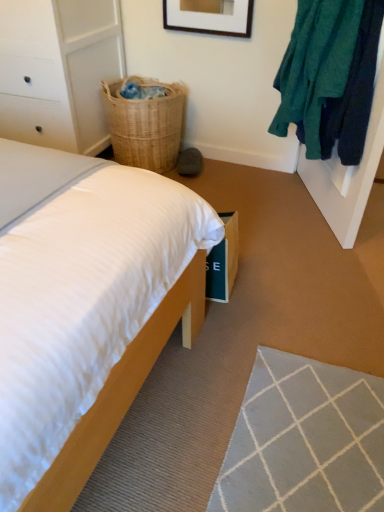
Question: Is white painted wood dresser at left taller than woven natural basket at upper right?

Choices:
 (A) yes
 (B) no

Answer: (A)

Question: Is woven natural basket at upper right completely or partially inside white painted wood dresser at left?

Choices:
 (A) yes
 (B) no

Answer: (B)

Question: From the image's perspective, is white painted wood dresser at left above woven natural basket at upper right?

Choices:
 (A) yes
 (B) no

Answer: (A)

Question: Considering the relative positions of white painted wood dresser at left and woven natural basket at upper right in the image provided, is white painted wood dresser at left to the left of woven natural basket at upper right from the viewer's perspective?

Choices:
 (A) no
 (B) yes

Answer: (B)

Question: From a real-world perspective, is white painted wood dresser at left positioned under woven natural basket at upper right based on gravity?

Choices:
 (A) yes
 (B) no

Answer: (B)

Question: From a real-world perspective, relative to white painted wood dresser at left, is teal fuzzy sweater at upper right vertically above or below?

Choices:
 (A) below
 (B) above

Answer: (B)

Question: Is teal fuzzy sweater at upper right inside or outside of white painted wood dresser at left?

Choices:
 (A) outside
 (B) inside

Answer: (A)

Question: Is point (360, 154) positioned closer to the camera than point (3, 75)?

Choices:
 (A) farther
 (B) closer

Answer: (B)

Question: Would you say teal fuzzy sweater at upper right is to the left or to the right of white painted wood dresser at left in the picture?

Choices:
 (A) right
 (B) left

Answer: (A)

Question: From a real-world perspective, relative to woven natural basket at upper right, is white painted wood dresser at left vertically above or below?

Choices:
 (A) above
 (B) below

Answer: (A)

Question: Based on their positions, is white painted wood dresser at left located to the left or right of woven natural basket at upper right?

Choices:
 (A) right
 (B) left

Answer: (B)

Question: Is white painted wood dresser at left in front of or behind woven natural basket at upper right in the image?

Choices:
 (A) front
 (B) behind

Answer: (A)

Question: Is white painted wood dresser at left taller or shorter than woven natural basket at upper right?

Choices:
 (A) tall
 (B) short

Answer: (A)

Question: Considering the positions of white painted wood dresser at left and wooden bed at lower left in the image, is white painted wood dresser at left taller or shorter than wooden bed at lower left?

Choices:
 (A) tall
 (B) short

Answer: (A)

Question: Based on their sizes in the image, would you say white painted wood dresser at left is bigger or smaller than wooden bed at lower left?

Choices:
 (A) big
 (B) small

Answer: (A)